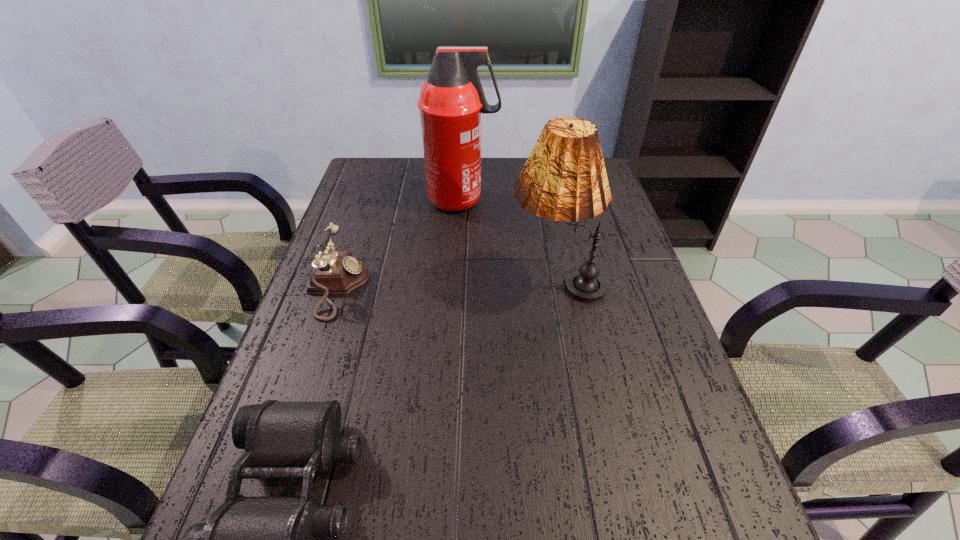
Find the location of a particular element. The width and height of the screenshot is (960, 540). object that is at the left edge is located at coordinates (335, 272).

Find the location of a particular element. The width and height of the screenshot is (960, 540). object present at the right edge is located at coordinates (564, 178).

Image resolution: width=960 pixels, height=540 pixels. Identify the location of free location at the left edge. (302, 330).

The image size is (960, 540). Find the location of `vacant space at the right edge of the desktop`. vacant space at the right edge of the desktop is located at coordinates (705, 443).

What are the coordinates of `free location at the far left corner of the desktop` in the screenshot? It's located at click(x=361, y=171).

This screenshot has height=540, width=960. I want to click on unoccupied area between the second shortest object and the lampshade, so click(x=447, y=284).

Where is `vacant region between the second shortest object and the rightmost object`? The image size is (960, 540). vacant region between the second shortest object and the rightmost object is located at coordinates 447,284.

Identify which object is located as the third nearest to the lampshade. Please provide its 2D coordinates. Your answer should be formatted as a tuple, i.e. [(x, y)], where the tuple contains the x and y coordinates of a point satisfying the conditions above.

[(247, 539)]

In order to click on object that stands as the closest to the telephone in this screenshot , I will do `click(451, 101)`.